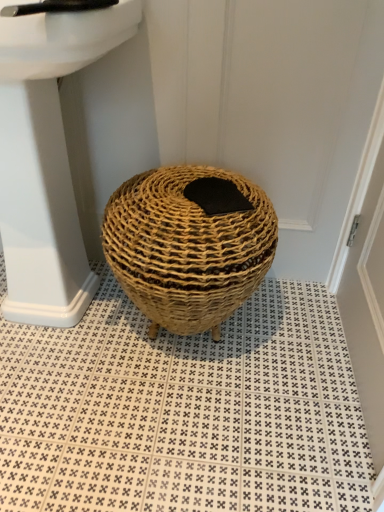
Find the location of a particular element. This screenshot has width=384, height=512. free location in front of white glossy sink at upper left is located at coordinates (77, 419).